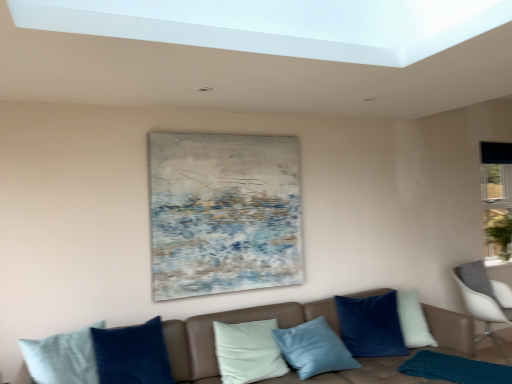
Find the location of a particular element. The height and width of the screenshot is (384, 512). vacant space situated above textured canvas painting at upper center (from a real-world perspective) is located at coordinates (222, 133).